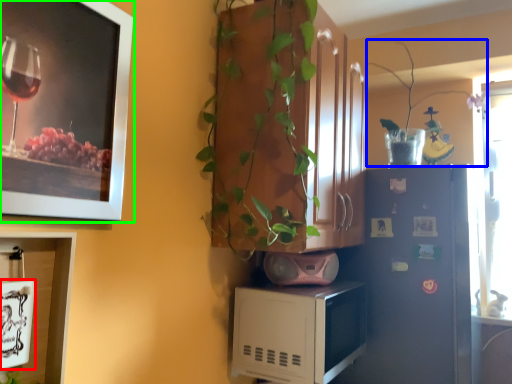
Question: Considering the real-world distances, which object is closest to picture frame (highlighted by a red box)? plant (highlighted by a blue box) or picture frame (highlighted by a green box).

Choices:
 (A) plant
 (B) picture frame

Answer: (B)